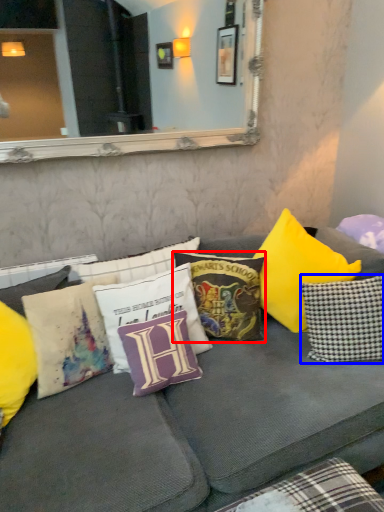
Question: Which of the following is the farthest to the observer, pillow (highlighted by a red box) or pillow (highlighted by a blue box)?

Choices:
 (A) pillow
 (B) pillow

Answer: (A)